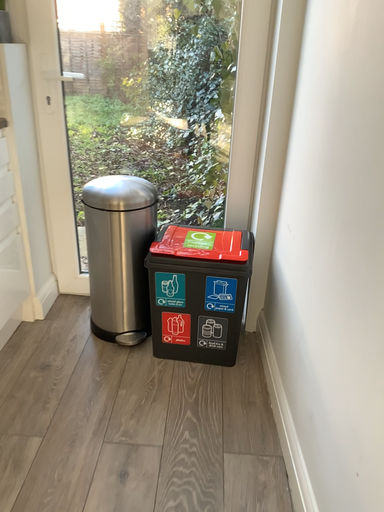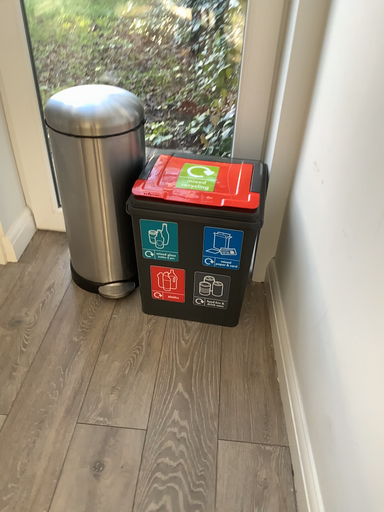
Question: How did the camera likely rotate when shooting the video?

Choices:
 (A) rotated downward
 (B) rotated upward

Answer: (A)